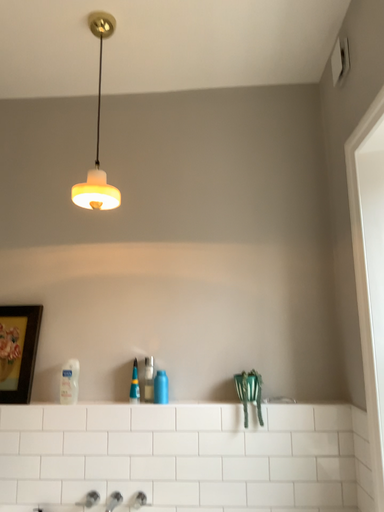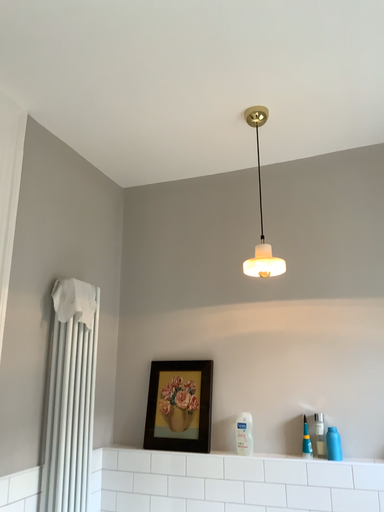
Question: How did the camera likely rotate when shooting the video?

Choices:
 (A) rotated right
 (B) rotated left

Answer: (B)